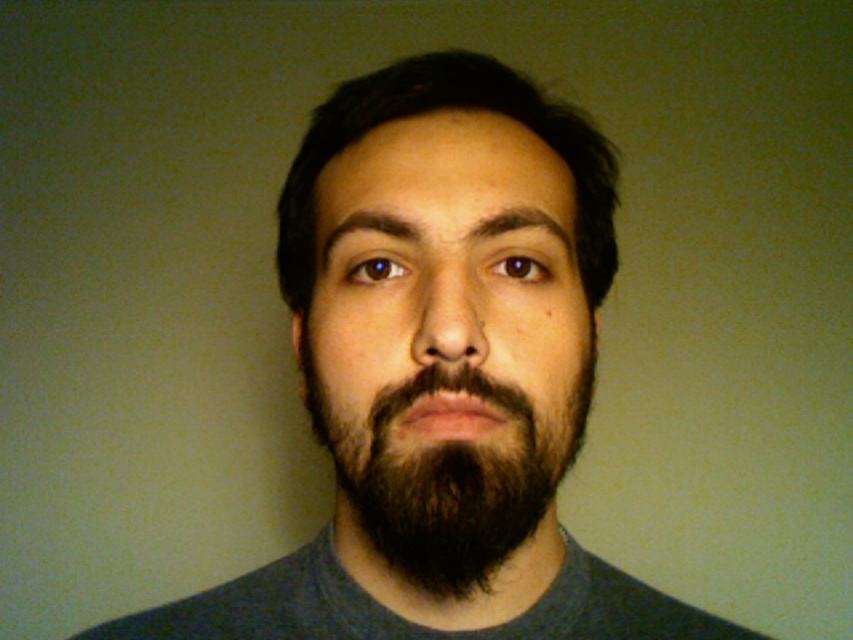
Question: Does dark brown fuzzy beard at center have a lesser width compared to dark brown hair at center?

Choices:
 (A) no
 (B) yes

Answer: (B)

Question: Which object appears farthest from the camera in this image?

Choices:
 (A) dark brown hair at center
 (B) dark brown fuzzy beard at center

Answer: (A)

Question: Is dark brown fuzzy beard at center to the right of dark brown hair at center from the viewer's perspective?

Choices:
 (A) no
 (B) yes

Answer: (A)

Question: Can you confirm if dark brown fuzzy beard at center is wider than dark brown hair at center?

Choices:
 (A) yes
 (B) no

Answer: (B)

Question: Which point is closer to the camera?

Choices:
 (A) (608, 196)
 (B) (387, 502)

Answer: (B)

Question: Which point is closer to the camera taking this photo?

Choices:
 (A) (531, 108)
 (B) (390, 548)

Answer: (B)